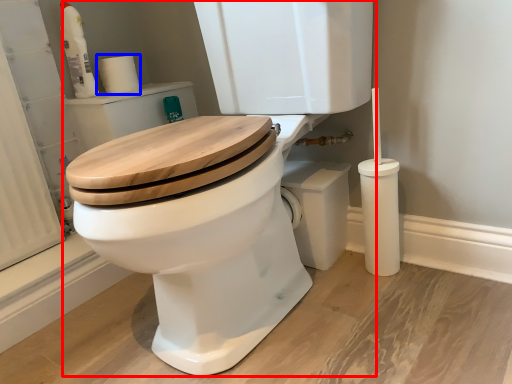
Question: Among these objects, which one is nearest to the camera, toilet (highlighted by a red box) or toilet paper (highlighted by a blue box)?

Choices:
 (A) toilet
 (B) toilet paper

Answer: (A)